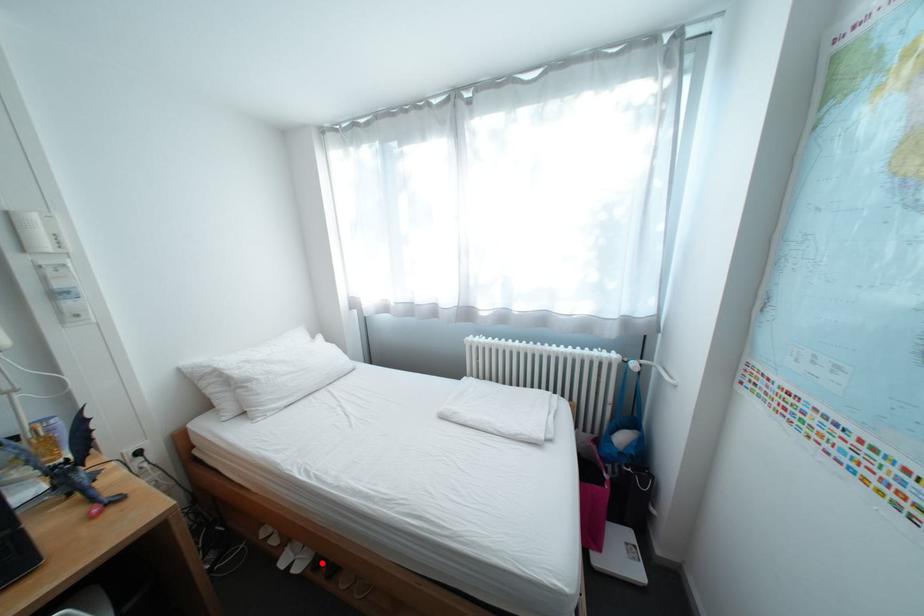
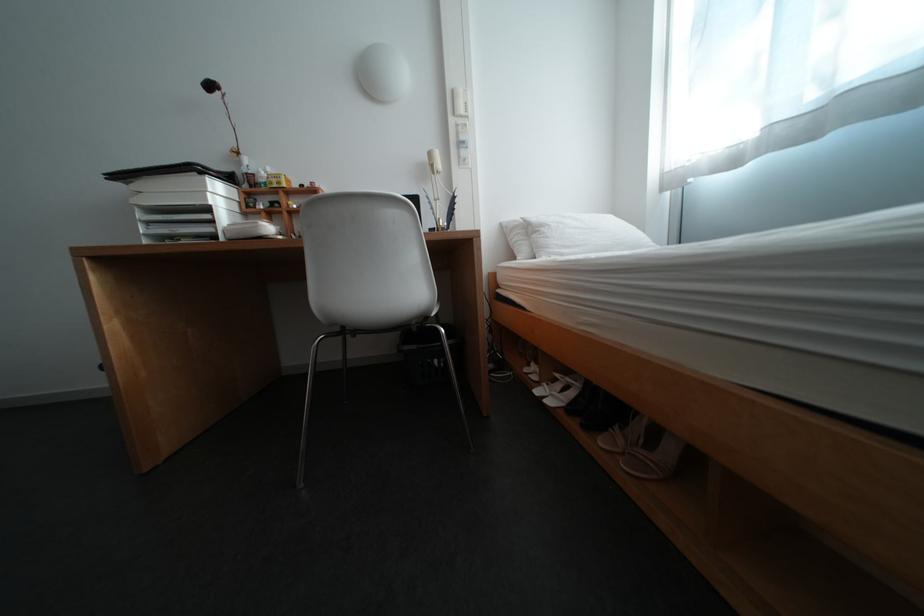
Where in the second image is the point corresponding to the highlighted location from the first image?

(576, 406)